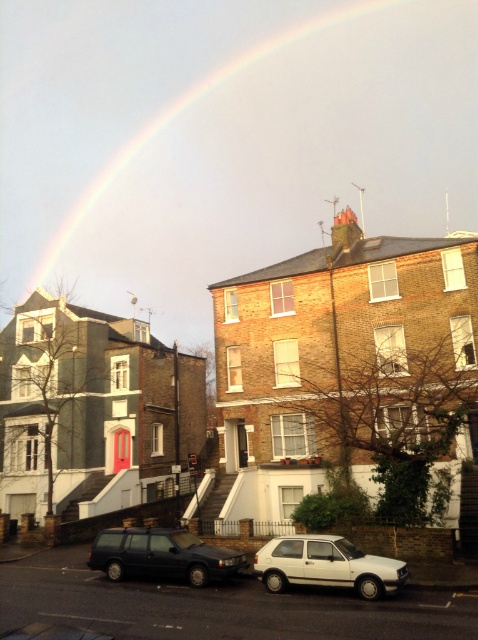
You are a delivery person needing to park your van between the white matte hatchback at lower center and the matte black station wagon at center. The van is 3 meters long. Can you safely park your van in this space without overlapping either vehicle?

The white matte hatchback at lower center is 2.83 meters away from the matte black station wagon at center. Since the van is 3 meters long, the space is slightly shorter than the van. Therefore, parking the van here would result in overlapping one of the vehicles, making it unsafe.